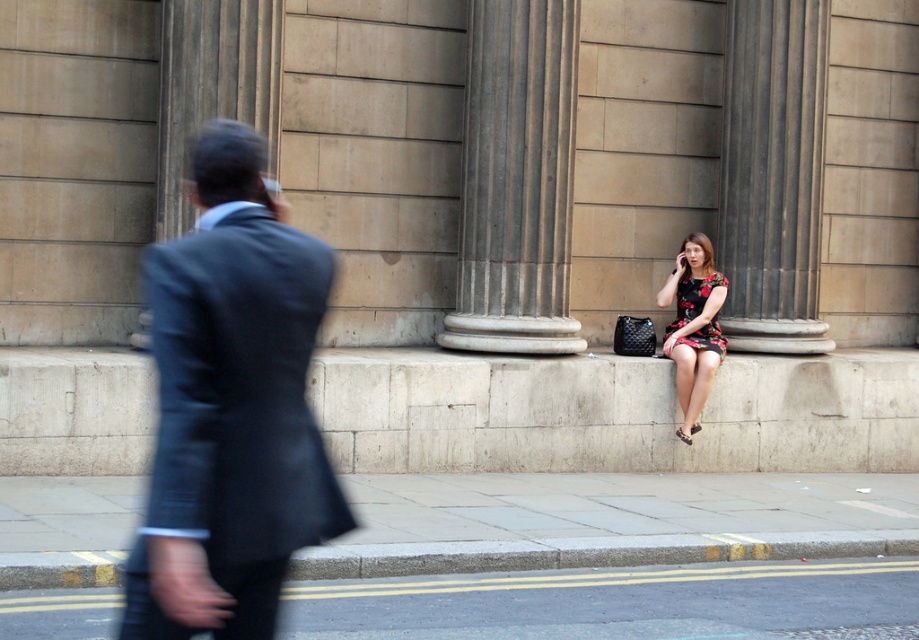
You are a delivery person standing at the yellow painted concrete curb at lower left and need to deliver a package to the floral dress at center. The curb is lower than the dress. What obstacle might you encounter while moving the package from the curb to the dress?

The yellow painted concrete curb at lower left is shorter than the floral dress at center, so you might have to lift the package slightly to move it from the lower curb to the higher position of the floral dress at center.

You are standing at the entrance of the classical building with columns and want to walk towards the smooth asphalt road at lower center. According to the image, in which direction should you go relative to your current position?

The smooth asphalt road at lower center is located at coordinates 0.942 on the x axis and 0.674 on the y axis. Since the x coordinate is greater than 0.5, it means the road is to the right side of the image. The y coordinate being 0.674 places it closer to the bottom of the image. Therefore, you should walk towards the bottom right direction relative to your current position at the entrance.